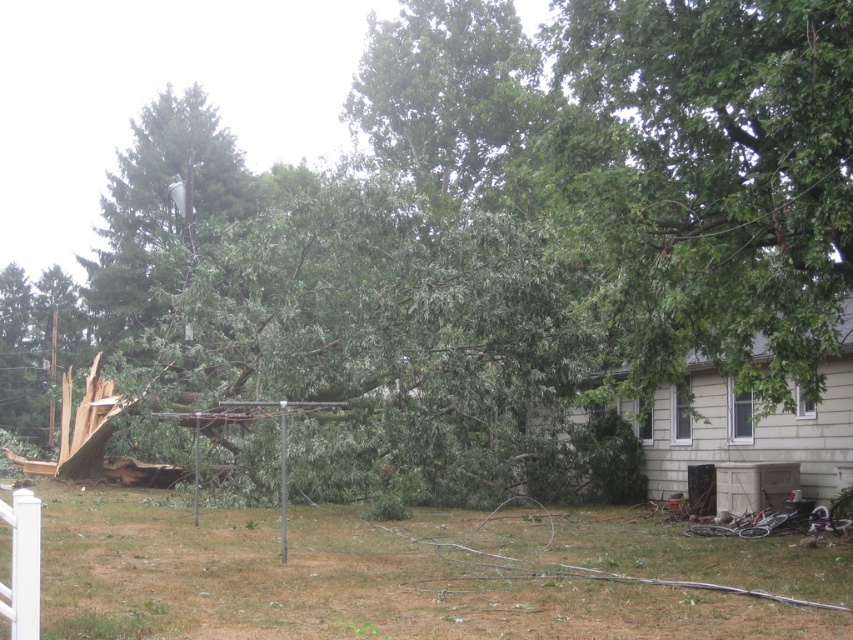
Does green leafy tree at upper right come in front of green leafy tree at upper left?

Yes, it is.

Who is more distant from viewer, (x=733, y=147) or (x=224, y=132)?

Positioned behind is point (x=224, y=132).

Between point (770, 141) and point (158, 147), which one is positioned behind?

The point (158, 147) is behind.

Where is `green leafy tree at upper right`? Image resolution: width=853 pixels, height=640 pixels. green leafy tree at upper right is located at coordinates (721, 177).

Who is positioned more to the right, brown wood debris at lower center or green leafy tree at upper left?

From the viewer's perspective, brown wood debris at lower center appears more on the right side.

Is brown wood debris at lower center thinner than green leafy tree at upper left?

Correct, brown wood debris at lower center's width is less than green leafy tree at upper left's.

This screenshot has height=640, width=853. Describe the element at coordinates (413, 573) in the screenshot. I see `brown wood debris at lower center` at that location.

At what (x,y) coordinates should I click in order to perform the action: click on brown wood debris at lower center. Please return your answer as a coordinate pair (x, y). This screenshot has height=640, width=853. Looking at the image, I should click on (413, 573).

Image resolution: width=853 pixels, height=640 pixels. What do you see at coordinates (413, 573) in the screenshot? I see `brown wood debris at lower center` at bounding box center [413, 573].

Is point (659, 528) less distant than point (641, 244)?

No.

Find the location of a particular element. brown wood debris at lower center is located at coordinates (413, 573).